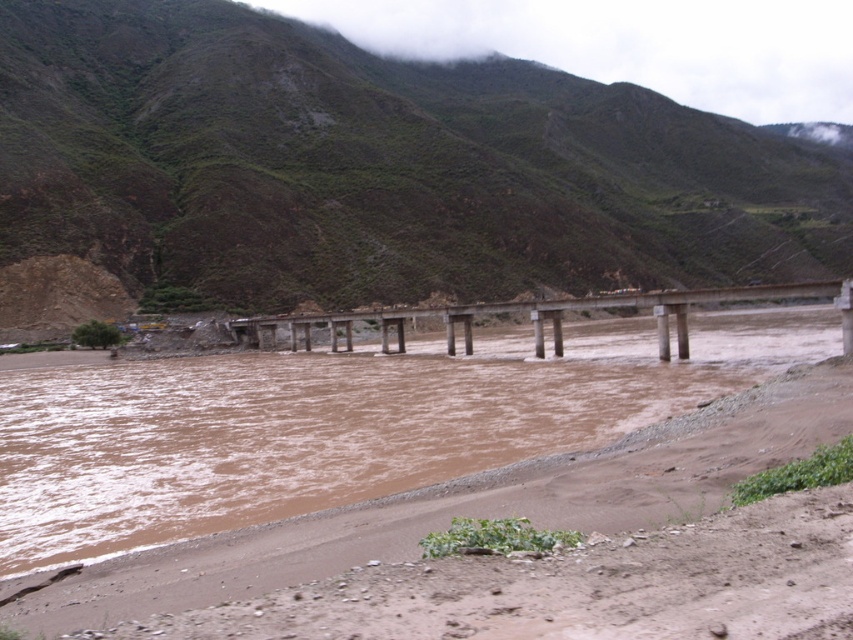
Question: Which point is closer to the camera taking this photo?

Choices:
 (A) (383, 253)
 (B) (215, 500)

Answer: (B)

Question: Is green grassy hillside at upper center positioned at the back of concrete bridge at center?

Choices:
 (A) yes
 (B) no

Answer: (A)

Question: Which of the following is the farthest from the observer?

Choices:
 (A) green grassy hillside at upper center
 (B) brown muddy water at center
 (C) concrete bridge at center

Answer: (A)

Question: Which point is farther to the camera?

Choices:
 (A) concrete bridge at center
 (B) brown muddy water at center

Answer: (A)

Question: Does brown muddy water at center appear on the right side of concrete bridge at center?

Choices:
 (A) yes
 (B) no

Answer: (B)

Question: Where is green grassy hillside at upper center located in relation to concrete bridge at center in the image?

Choices:
 (A) above
 (B) below

Answer: (A)